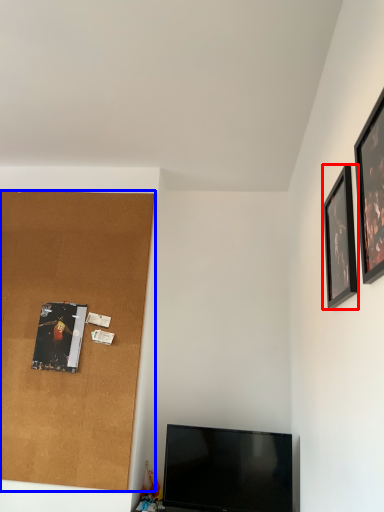
Question: Among these objects, which one is farthest to the camera, picture frame (highlighted by a red box) or plywood (highlighted by a blue box)?

Choices:
 (A) picture frame
 (B) plywood

Answer: (B)